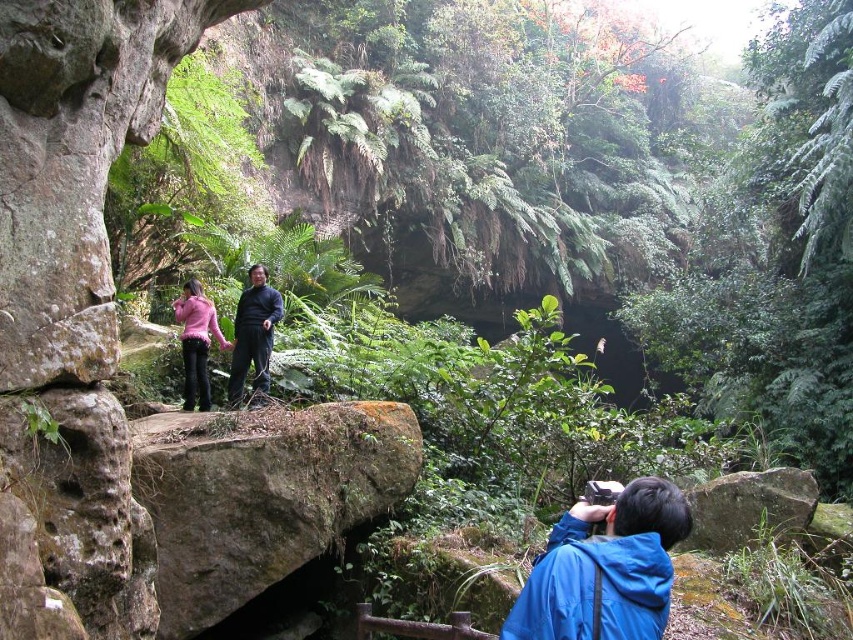
Question: Which point is farther to the camera?

Choices:
 (A) brown rough rock at center
 (B) dark blue sweater at center
 (C) blue fabric jacket at lower right
 (D) smooth gray rock at lower right

Answer: (B)

Question: Which point is farther to the camera?

Choices:
 (A) (341, 476)
 (B) (717, 518)
 (C) (83, 472)

Answer: (B)

Question: Is rusty stone bridge at center closer to camera compared to brown rough rock at center?

Choices:
 (A) no
 (B) yes

Answer: (B)

Question: Which of the following is the farthest from the observer?

Choices:
 (A) smooth gray rock at lower right
 (B) blue fabric jacket at lower right
 (C) dark blue sweater at center
 (D) brown rough rock at center

Answer: (C)

Question: Does brown rough rock at center have a lesser width compared to blue fabric jacket at lower right?

Choices:
 (A) yes
 (B) no

Answer: (B)

Question: Does smooth gray rock at lower right have a greater width compared to dark blue sweater at center?

Choices:
 (A) no
 (B) yes

Answer: (B)